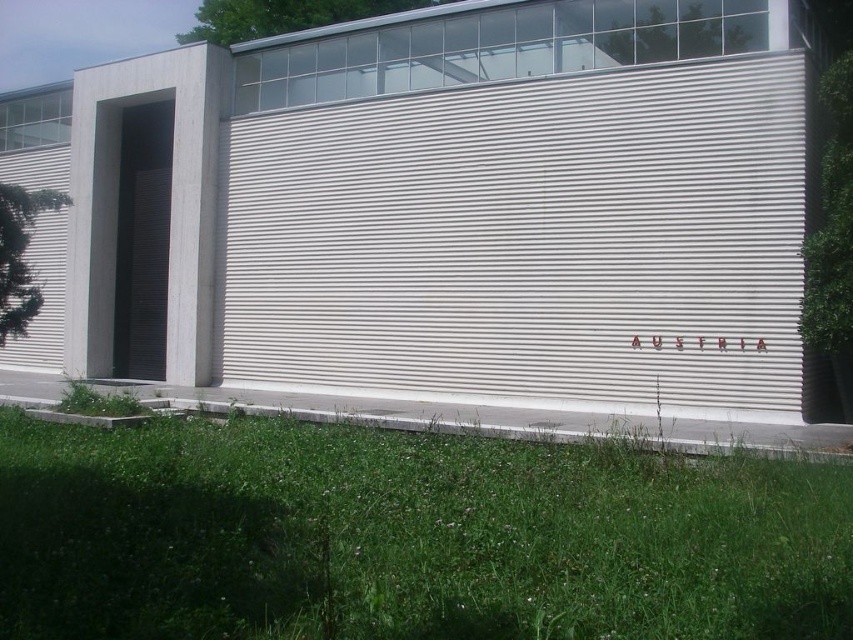
Question: In this image, where is white corrugated metal at center located relative to green grass at lower center?

Choices:
 (A) below
 (B) above

Answer: (B)

Question: Which object is closer to the camera taking this photo?

Choices:
 (A) white corrugated metal at center
 (B) green grass at lower center

Answer: (B)

Question: Is white corrugated metal at center wider than green grass at lower center?

Choices:
 (A) yes
 (B) no

Answer: (A)

Question: Does white corrugated metal at center appear under green grass at lower center?

Choices:
 (A) yes
 (B) no

Answer: (B)

Question: Among these objects, which one is farthest from the camera?

Choices:
 (A) green grass at lower center
 (B) white corrugated metal at center

Answer: (B)